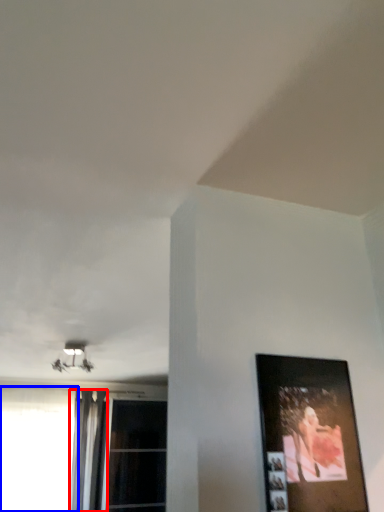
Question: Which point is further to the camera, curtain (highlighted by a red box) or window (highlighted by a blue box)?

Choices:
 (A) curtain
 (B) window

Answer: (A)